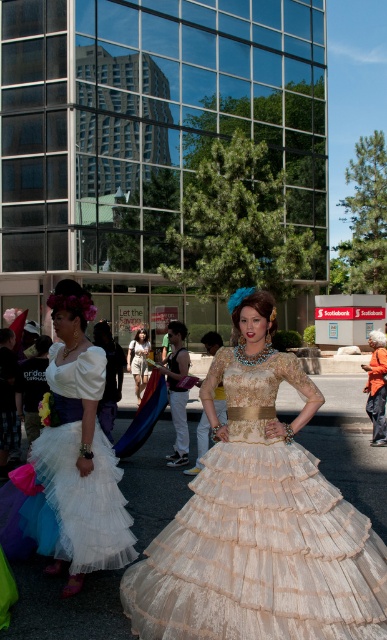
In order to click on orange fabric jacket at right in this screenshot , I will do `click(376, 387)`.

Where is `orange fabric jacket at right`? orange fabric jacket at right is located at coordinates click(376, 387).

Is point (232, 573) behind point (90, 364)?

No, it is in front of (90, 364).

Who is positioned more to the left, ivory lace dress at center or white tulle dress at center?

white tulle dress at center

Measure the distance between ivory lace dress at center and camera.

ivory lace dress at center is 3.19 meters away from camera.

You are a GUI agent. You are given a task and a screenshot of the screen. Output one action in this format:
    pyautogui.click(x=<x>, y=<y>)
    Task: Click on the ivory lace dress at center
    
    Given the screenshot: What is the action you would take?
    pyautogui.click(x=260, y=534)

Is point (375, 592) closer to camera compared to point (142, 348)?

Yes, point (375, 592) is closer to viewer.

Is ivory lace dress at center further to the viewer compared to white cotton dress at center?

No, it is not.

Image resolution: width=387 pixels, height=640 pixels. What are the coordinates of `ivory lace dress at center` in the screenshot? It's located at (260, 534).

Locate an element on the screen. The height and width of the screenshot is (640, 387). ivory lace dress at center is located at coordinates (260, 534).